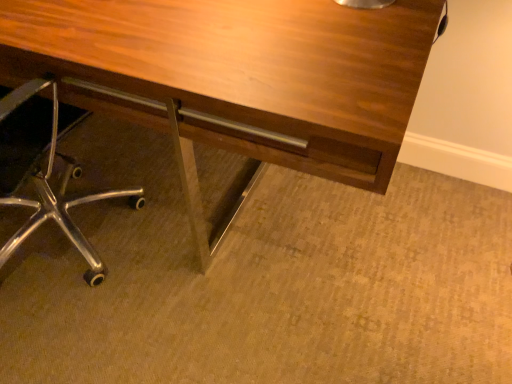
Question: From the image's perspective, is wooden desk at center located above metal/chrome chair at lower left?

Choices:
 (A) no
 (B) yes

Answer: (B)

Question: Does wooden desk at center have a larger size compared to metal/chrome chair at lower left?

Choices:
 (A) no
 (B) yes

Answer: (B)

Question: Can you confirm if wooden desk at center is smaller than metal/chrome chair at lower left?

Choices:
 (A) no
 (B) yes

Answer: (A)

Question: Is metal/chrome chair at lower left located within wooden desk at center?

Choices:
 (A) no
 (B) yes

Answer: (B)

Question: Considering the relative positions of wooden desk at center and metal/chrome chair at lower left in the image provided, is wooden desk at center in front of metal/chrome chair at lower left?

Choices:
 (A) no
 (B) yes

Answer: (A)

Question: From a real-world perspective, is wooden desk at center below metal/chrome chair at lower left?

Choices:
 (A) yes
 (B) no

Answer: (A)

Question: Is wooden desk at center completely or partially inside metal/chrome chair at lower left?

Choices:
 (A) no
 (B) yes

Answer: (A)

Question: Is metal/chrome chair at lower left looking in the opposite direction of wooden desk at center?

Choices:
 (A) yes
 (B) no

Answer: (B)

Question: Considering the relative sizes of metal/chrome chair at lower left and wooden desk at center in the image provided, is metal/chrome chair at lower left thinner than wooden desk at center?

Choices:
 (A) yes
 (B) no

Answer: (A)

Question: Can you confirm if metal/chrome chair at lower left is bigger than wooden desk at center?

Choices:
 (A) no
 (B) yes

Answer: (A)

Question: Does metal/chrome chair at lower left touch wooden desk at center?

Choices:
 (A) no
 (B) yes

Answer: (A)

Question: Does metal/chrome chair at lower left turn towards wooden desk at center?

Choices:
 (A) yes
 (B) no

Answer: (A)

Question: From the image's perspective, is wooden desk at center above or below metal/chrome chair at lower left?

Choices:
 (A) above
 (B) below

Answer: (A)